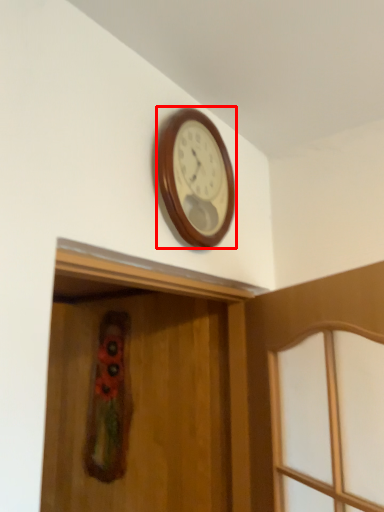
Question: From the image's perspective, where is wall clock (annotated by the red box) located relative to screen door?

Choices:
 (A) above
 (B) below

Answer: (A)